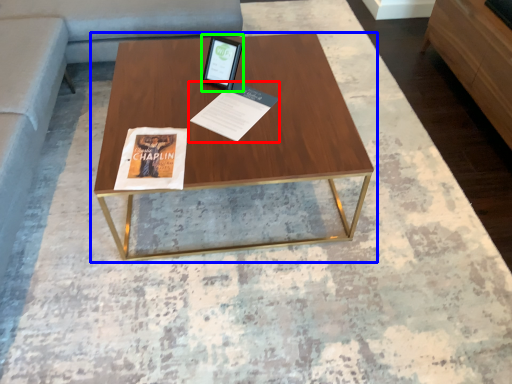
Question: Which is farther away from magazine (highlighted by a red box)? coffee table (highlighted by a blue box) or tablet computer (highlighted by a green box)?

Choices:
 (A) coffee table
 (B) tablet computer

Answer: (A)